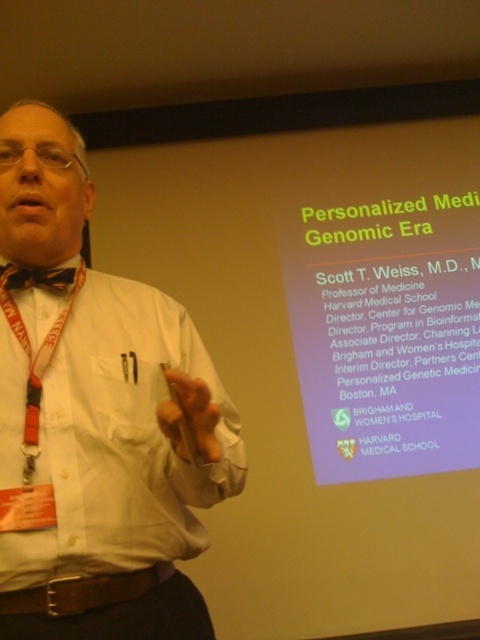
Question: In this image, where is matte black bow tie at left located relative to brown textured bow tie at center?

Choices:
 (A) above
 (B) below

Answer: (B)

Question: Which of the following is the closest to the observer?

Choices:
 (A) (46, 269)
 (B) (95, 387)

Answer: (B)

Question: Which point is closer to the camera taking this photo?

Choices:
 (A) (37, 269)
 (B) (13, 442)

Answer: (B)

Question: Can you confirm if matte black bow tie at left is bigger than brown textured bow tie at center?

Choices:
 (A) yes
 (B) no

Answer: (A)

Question: Does matte black bow tie at left have a greater width compared to brown textured bow tie at center?

Choices:
 (A) yes
 (B) no

Answer: (A)